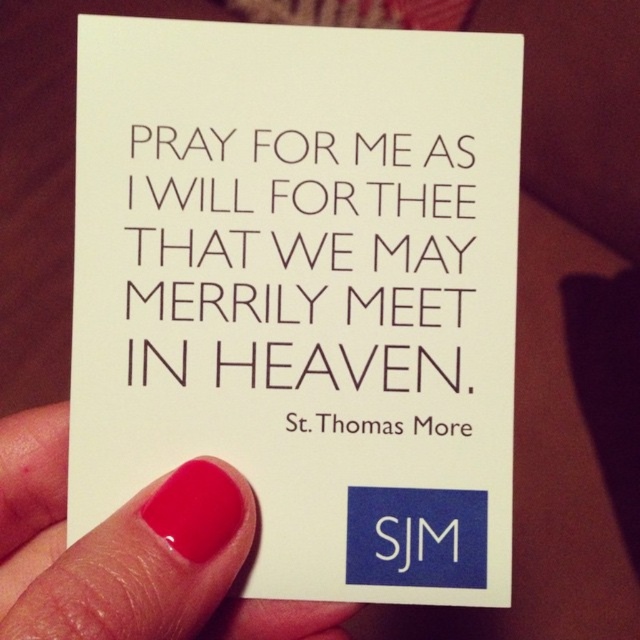
Who is positioned more to the left, black paper text at center or pink nail polish at lower left?

Positioned to the left is pink nail polish at lower left.

Is black paper text at center smaller than pink nail polish at lower left?

Correct, black paper text at center occupies less space than pink nail polish at lower left.

Who is more distant from viewer, (211, 243) or (65, 525)?

The point (65, 525) is behind.

Where is `black paper text at center`? black paper text at center is located at coordinates (304, 282).

Which is in front, point (106, 280) or point (168, 314)?

Point (106, 280)

Between white paper at center and black paper text at center, which one appears on the right side from the viewer's perspective?

black paper text at center is more to the right.

This screenshot has height=640, width=640. Find the location of `white paper at center`. white paper at center is located at coordinates (304, 292).

Which of these two, white paper at center or pink nail polish at lower left, stands taller?

With more height is white paper at center.

Between point (294, 449) and point (99, 561), which one is positioned in front?

Point (99, 561) is more forward.

Between point (216, 268) and point (44, 628), which one is positioned in front?

Point (44, 628) is in front.

Identify the location of white paper at center. The width and height of the screenshot is (640, 640). (304, 292).